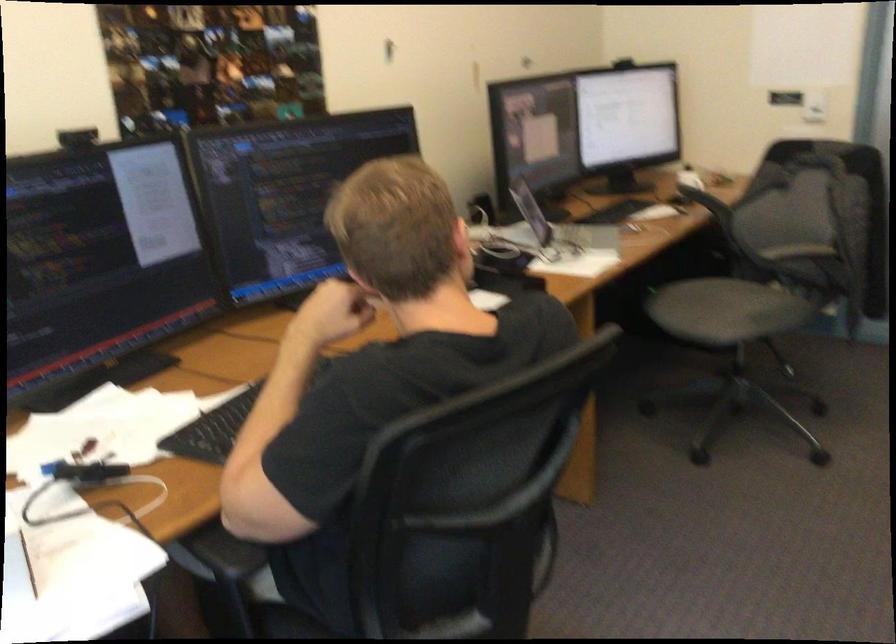
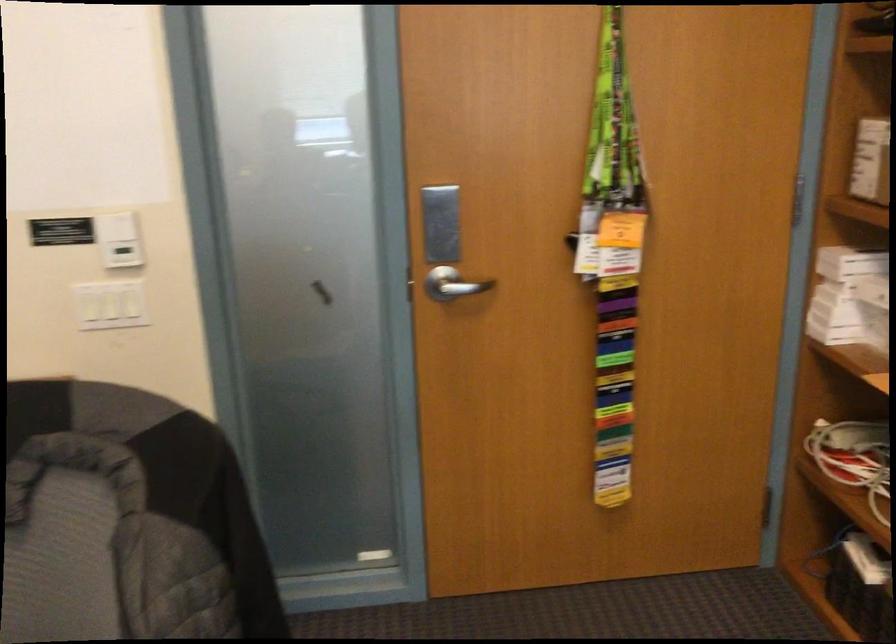
Locate, in the second image, the point that corresponds to [805,125] in the first image.

(109, 305)